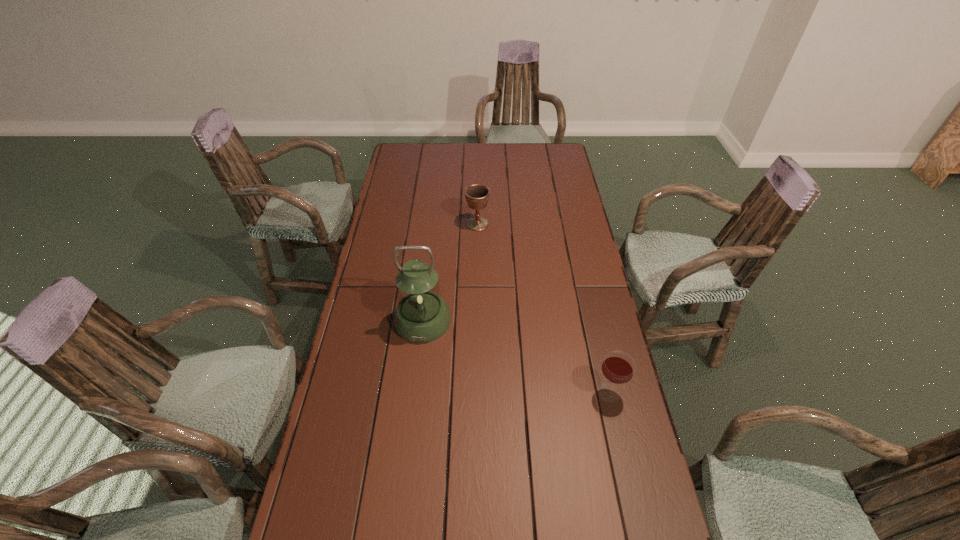
This screenshot has width=960, height=540. Find the location of `object that is at the right edge`. object that is at the right edge is located at coordinates (618, 367).

The height and width of the screenshot is (540, 960). Find the location of `free space at the far edge`. free space at the far edge is located at coordinates (463, 156).

The image size is (960, 540). I want to click on free point at the left edge, so click(x=387, y=186).

Where is `vacant space at the right edge of the desktop`? This screenshot has width=960, height=540. vacant space at the right edge of the desktop is located at coordinates (578, 297).

Locate an element on the screen. The image size is (960, 540). free space between the wineglass and the second farthest object is located at coordinates (516, 356).

Identify the location of free space between the lantern and the wineglass. (516, 356).

I want to click on free space between the second farthest object and the rightmost object, so click(x=516, y=356).

The height and width of the screenshot is (540, 960). Find the location of `blank region between the second object from left to right and the lantern`. blank region between the second object from left to right and the lantern is located at coordinates (450, 272).

Identify the location of empty location between the leftmost object and the wineglass. (516, 356).

Identify the location of blank region between the nearest object and the second farthest object. coord(516,356).